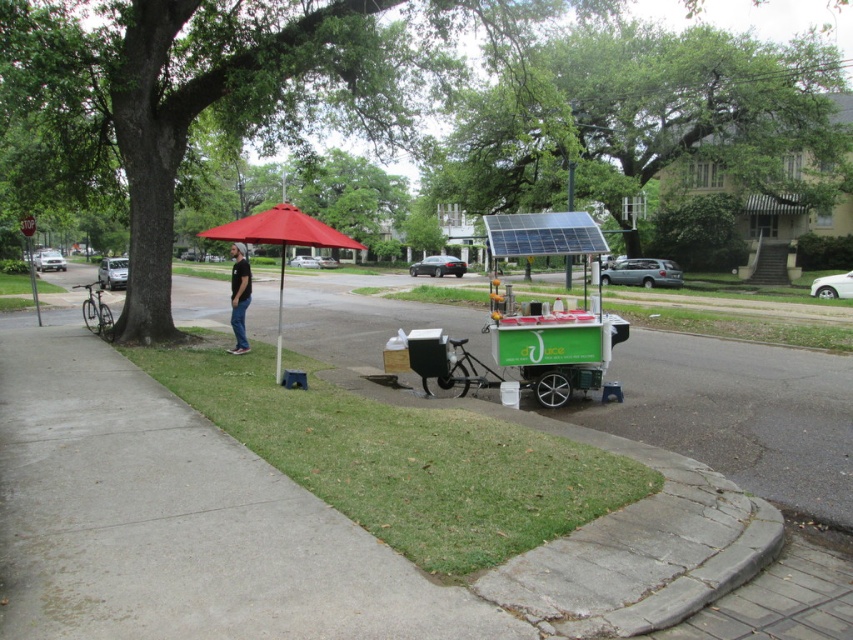
Question: Is red fabric umbrella at center wider than black cotton shirt at center?

Choices:
 (A) no
 (B) yes

Answer: (B)

Question: Among these objects, which one is farthest from the camera?

Choices:
 (A) black cotton shirt at center
 (B) red fabric umbrella at center

Answer: (A)

Question: Which point is closer to the camera?

Choices:
 (A) black cotton shirt at center
 (B) red fabric umbrella at center

Answer: (B)

Question: Among these objects, which one is farthest from the camera?

Choices:
 (A) black cotton shirt at center
 (B) red fabric umbrella at center

Answer: (A)

Question: Does red fabric umbrella at center have a larger size compared to black cotton shirt at center?

Choices:
 (A) yes
 (B) no

Answer: (A)

Question: Is red fabric umbrella at center closer to the viewer compared to black cotton shirt at center?

Choices:
 (A) no
 (B) yes

Answer: (B)